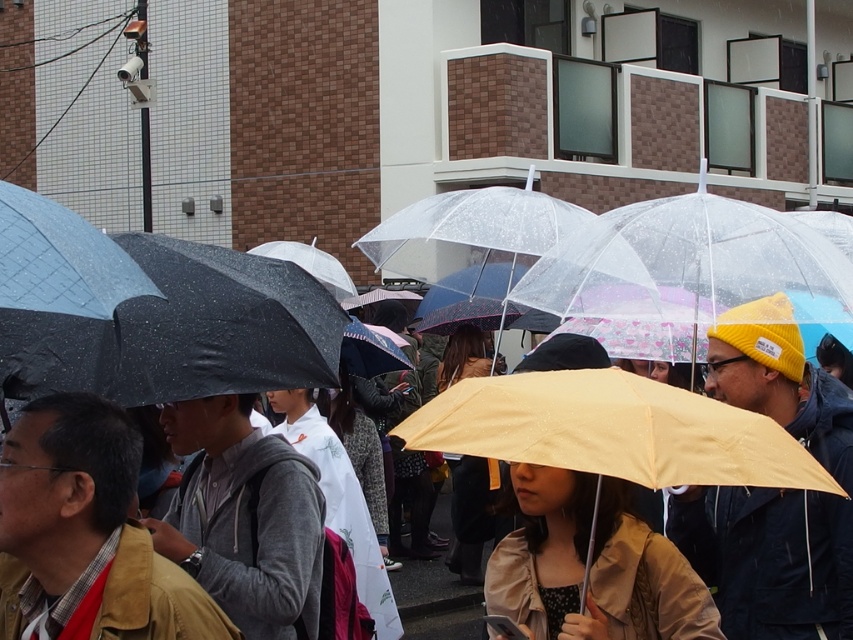
You are standing at the origin point in the image and want to locate the gray fleece jacket at center. Which direction should you move to reach it?

The gray fleece jacket at center is located at point 0.809 on the x axis and 0.286 on the y axis. Since you are at the origin, you should move right along the x axis and slightly up along the y axis to reach it.

You are a photographer trying to capture a shot of both the gray fleece jacket at center and the tan fabric jacket at center. Since you want to ensure both are in the frame, can you determine which jacket is positioned to the left of the other?

The gray fleece jacket at center is to the left of the tan fabric jacket at center, so to capture both in the frame, position your camera to include the left side where the gray fleece jacket at center is and extend towards the right where the tan fabric jacket at center is located.

You are a delivery person carrying a package that measures 3 feet in length. You need to navigate through the crowd outside the modern building. Can you fit between the gray fleece jacket at center and the tan fabric jacket at center without squeezing?

The distance between the gray fleece jacket at center and the tan fabric jacket at center is 3.73 feet, which is wider than the package length of 3 feet. Therefore, you can fit between them without squeezing.